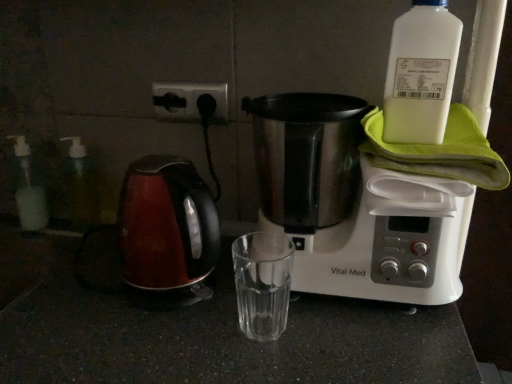
Describe the element at coordinates (188, 101) in the screenshot. I see `black plastic socket at upper center` at that location.

Locate an element on the screen. Image resolution: width=512 pixels, height=384 pixels. stainless steel coffee maker at upper right is located at coordinates 352,205.

Locate an element on the screen. This screenshot has height=384, width=512. shiny red kettle at left is located at coordinates (167, 232).

Find the location of a particular element. black plastic socket at upper center is located at coordinates (188, 101).

Which is behind, stainless steel coffee maker at upper right or white plastic bottle at upper right, the third bottle in the left-to-right sequence?

white plastic bottle at upper right, the third bottle in the left-to-right sequence.

Considering the sizes of objects stainless steel coffee maker at upper right and white plastic bottle at upper right, marked as the first bottle in a right-to-left arrangement, in the image provided, who is shorter, stainless steel coffee maker at upper right or white plastic bottle at upper right, marked as the first bottle in a right-to-left arrangement,?

white plastic bottle at upper right, marked as the first bottle in a right-to-left arrangement.

Is stainless steel coffee maker at upper right positioned with its back to white plastic bottle at upper right, the third bottle when ordered from back to front?

stainless steel coffee maker at upper right is not turned away from white plastic bottle at upper right, the third bottle when ordered from back to front.

Would you say stainless steel coffee maker at upper right is a long distance from white plastic bottle at upper right, the third bottle when ordered from back to front?

No, stainless steel coffee maker at upper right is not far from white plastic bottle at upper right, the third bottle when ordered from back to front.

From a real-world perspective, which object rests below the other?

In real-world perspective, translucent plastic soap dispenser at left, the first bottle viewed from the left, is lower.

Which object is closer to the camera taking this photo, translucent plastic soap dispenser at left, the first bottle viewed from the left, or white plastic bottle at upper right, the third bottle in the left-to-right sequence?

white plastic bottle at upper right, the third bottle in the left-to-right sequence, is in front.

How distant is translucent plastic soap dispenser at left, the third bottle viewed from the front, from white plastic bottle at upper right, marked as the first bottle in a right-to-left arrangement?

The distance of translucent plastic soap dispenser at left, the third bottle viewed from the front, from white plastic bottle at upper right, marked as the first bottle in a right-to-left arrangement, is 30.31 inches.

Is translucent plastic soap dispenser at left, the third bottle viewed from the front, not close to white plastic bottle at upper right, marked as the first bottle in a right-to-left arrangement?

No, translucent plastic soap dispenser at left, the third bottle viewed from the front, is in close proximity to white plastic bottle at upper right, marked as the first bottle in a right-to-left arrangement.

Is shiny red kettle at left closer to camera compared to transparent plastic bottle at left, positioned as the 2th bottle in left-to-right order?

Yes, shiny red kettle at left is in front of transparent plastic bottle at left, positioned as the 2th bottle in left-to-right order.

Considering the sizes of objects shiny red kettle at left and transparent plastic bottle at left, which is the second bottle from back to front, in the image provided, who is wider, shiny red kettle at left or transparent plastic bottle at left, which is the second bottle from back to front,?

shiny red kettle at left.

Would you say shiny red kettle at left is a long distance from transparent plastic bottle at left, the 2th bottle in the right-to-left sequence?

Actually, shiny red kettle at left and transparent plastic bottle at left, the 2th bottle in the right-to-left sequence, are a little close together.

Consider the image. Is black plastic socket at upper center at the right side of stainless steel coffee maker at upper right?

No.

Is stainless steel coffee maker at upper right a part of black plastic socket at upper center?

No, stainless steel coffee maker at upper right is not a part of black plastic socket at upper center.

Which object is closer to the camera, translucent plastic soap dispenser at left, the 3th bottle positioned from the right, or transparent plastic bottle at left, positioned as the 2th bottle in left-to-right order?

Positioned in front is transparent plastic bottle at left, positioned as the 2th bottle in left-to-right order.

From a real-world perspective, which is physically above, translucent plastic soap dispenser at left, which is the 1th bottle in back-to-front order, or transparent plastic bottle at left, the 2th bottle in the right-to-left sequence?

transparent plastic bottle at left, the 2th bottle in the right-to-left sequence, is physically above.

Measure the distance from translucent plastic soap dispenser at left, which is the 1th bottle in back-to-front order, to transparent plastic bottle at left, the 2th bottle positioned from the front.

translucent plastic soap dispenser at left, which is the 1th bottle in back-to-front order, and transparent plastic bottle at left, the 2th bottle positioned from the front, are 3.45 inches apart.

From the image's perspective, which one is positioned lower, transparent plastic bottle at left, the 2th bottle in the right-to-left sequence, or shiny red kettle at left?

shiny red kettle at left.

Consider the image. From a real-world perspective, does transparent plastic bottle at left, the 2th bottle positioned from the front, stand above shiny red kettle at left?

Correct, in the physical world, transparent plastic bottle at left, the 2th bottle positioned from the front, is higher than shiny red kettle at left.

Can you confirm if transparent plastic bottle at left, which is the second bottle from back to front, is taller than shiny red kettle at left?

No, transparent plastic bottle at left, which is the second bottle from back to front, is not taller than shiny red kettle at left.

Is shiny red kettle at left surrounded by transparent plastic bottle at left, the 2th bottle positioned from the front?

Definitely not — shiny red kettle at left is not inside transparent plastic bottle at left, the 2th bottle positioned from the front.

Is white plastic bottle at upper right, the third bottle in the left-to-right sequence, thinner than stainless steel coffee maker at upper right?

Yes.

Is white plastic bottle at upper right, the first bottle in the front-to-back sequence, oriented towards stainless steel coffee maker at upper right?

No, white plastic bottle at upper right, the first bottle in the front-to-back sequence, is not aimed at stainless steel coffee maker at upper right.

Who is bigger, white plastic bottle at upper right, the first bottle in the front-to-back sequence, or stainless steel coffee maker at upper right?

With larger size is stainless steel coffee maker at upper right.

At what (x,y) coordinates should I click in order to perform the action: click on the 3rd bottle positioned above the stainless steel coffee maker at upper right (from the image's perspective). Please return your answer as a coordinate pair (x, y). The image size is (512, 384). Looking at the image, I should click on (421, 73).

From a real-world perspective, count 2nd bottles downward from the white plastic bottle at upper right, marked as the first bottle in a right-to-left arrangement, and point to it. Please provide its 2D coordinates.

[(28, 189)]

Based on their spatial positions, is white plastic bottle at upper right, the first bottle in the front-to-back sequence, or shiny red kettle at left further from stainless steel coffee maker at upper right?

shiny red kettle at left is further to stainless steel coffee maker at upper right.

Looking at this image, which object lies nearer to the anchor point stainless steel coffee maker at upper right, transparent plastic bottle at left, positioned as the 2th bottle in left-to-right order, or white plastic bottle at upper right, the third bottle in the left-to-right sequence?

white plastic bottle at upper right, the third bottle in the left-to-right sequence, is closer to stainless steel coffee maker at upper right.

Based on the photo, when comparing their distances from stainless steel coffee maker at upper right, does white plastic bottle at upper right, the third bottle when ordered from back to front, or translucent plastic soap dispenser at left, the first bottle viewed from the left, seem closer?

white plastic bottle at upper right, the third bottle when ordered from back to front.

From the image, which object appears to be nearer to stainless steel coffee maker at upper right, shiny red kettle at left or black plastic socket at upper center?

Based on the image, shiny red kettle at left appears to be nearer to stainless steel coffee maker at upper right.

From the image, which object appears to be farther from black plastic socket at upper center, stainless steel coffee maker at upper right or transparent plastic bottle at left, which is the second bottle from back to front?

stainless steel coffee maker at upper right.

Estimate the real-world distances between objects in this image. Which object is closer to black plastic socket at upper center, white plastic bottle at upper right, the third bottle in the left-to-right sequence, or transparent plastic bottle at left, the 2th bottle in the right-to-left sequence?

Among the two, transparent plastic bottle at left, the 2th bottle in the right-to-left sequence, is located nearer to black plastic socket at upper center.

From the image, which object appears to be nearer to stainless steel coffee maker at upper right, black plastic socket at upper center or transparent plastic bottle at left, positioned as the 2th bottle in left-to-right order?

black plastic socket at upper center is closer to stainless steel coffee maker at upper right.

When comparing their distances from shiny red kettle at left, does white plastic bottle at upper right, marked as the first bottle in a right-to-left arrangement, or stainless steel coffee maker at upper right seem closer?

stainless steel coffee maker at upper right.

Locate an element on the screen. This screenshot has width=512, height=384. electric outlet situated between shiny red kettle at left and white plastic bottle at upper right, the first bottle in the front-to-back sequence, from left to right is located at coordinates (188, 101).

Where is `electric outlet located between transparent plastic bottle at left, positioned as the 2th bottle in left-to-right order, and stainless steel coffee maker at upper right in the left-right direction`? The width and height of the screenshot is (512, 384). electric outlet located between transparent plastic bottle at left, positioned as the 2th bottle in left-to-right order, and stainless steel coffee maker at upper right in the left-right direction is located at coordinates pos(188,101).

You are a GUI agent. You are given a task and a screenshot of the screen. Output one action in this format:
    pyautogui.click(x=<x>, y=<y>)
    Task: Click on the bottle situated between translucent plastic soap dispenser at left, the third bottle viewed from the front, and black plastic socket at upper center from left to right
    
    Given the screenshot: What is the action you would take?
    pyautogui.click(x=81, y=187)

Locate an element on the screen. The height and width of the screenshot is (384, 512). bottle located between translucent plastic soap dispenser at left, the first bottle viewed from the left, and shiny red kettle at left in the left-right direction is located at coordinates (81, 187).